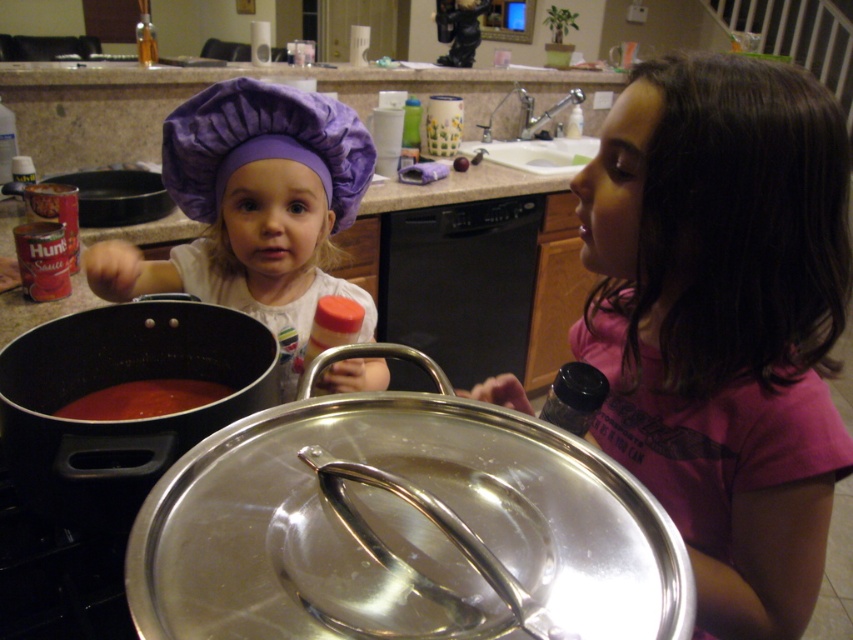
Is pink fabric shirt at upper right bigger than purple fabric chef hat at upper left?

Yes.

Is pink fabric shirt at upper right above purple fabric chef hat at upper left?

Actually, pink fabric shirt at upper right is below purple fabric chef hat at upper left.

You are a GUI agent. You are given a task and a screenshot of the screen. Output one action in this format:
    pyautogui.click(x=<x>, y=<y>)
    Task: Click on the pink fabric shirt at upper right
    The width and height of the screenshot is (853, 640).
    Given the screenshot: What is the action you would take?
    pyautogui.click(x=723, y=321)

Based on the photo, does purple fabric chef hat at upper left have a lesser height compared to smooth tomato sauce at left?

No.

Which of these two, purple fabric chef hat at upper left or smooth tomato sauce at left, stands taller?

Standing taller between the two is purple fabric chef hat at upper left.

Who is more forward, (115, 259) or (67, 404)?

Point (67, 404)

Image resolution: width=853 pixels, height=640 pixels. In order to click on purple fabric chef hat at upper left in this screenshot , I will do `click(254, 209)`.

Who is more distant from viewer, (x=828, y=93) or (x=103, y=396)?

The point (x=103, y=396) is more distant.

Measure the distance from pink fabric shirt at upper right to smooth tomato sauce at left.

pink fabric shirt at upper right and smooth tomato sauce at left are 21.70 inches apart.

Is point (663, 252) positioned in front of point (90, 412)?

Yes, point (663, 252) is closer to viewer.

Where is `pink fabric shirt at upper right`? pink fabric shirt at upper right is located at coordinates (723, 321).